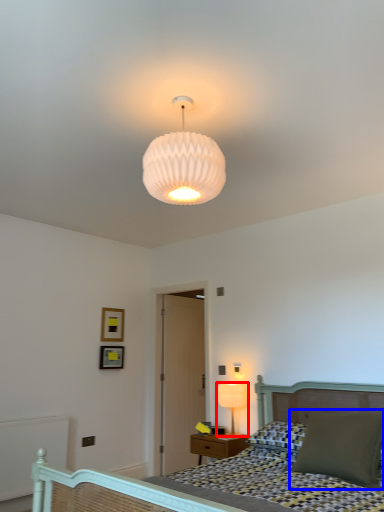
Question: Which of the following is the closest to the observer, lamp (highlighted by a red box) or pillow (highlighted by a blue box)?

Choices:
 (A) lamp
 (B) pillow

Answer: (B)